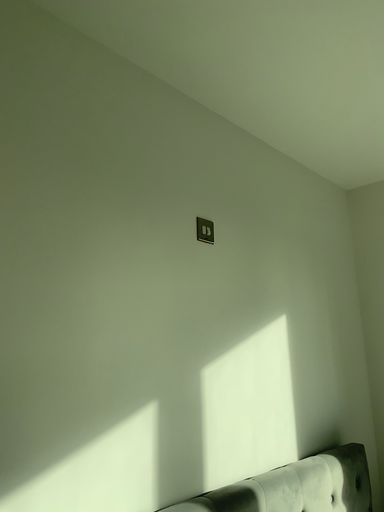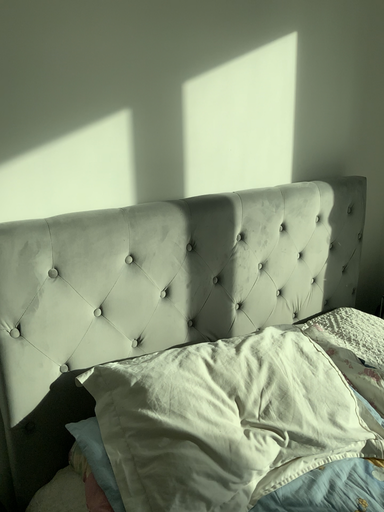
Question: Which way did the camera rotate in the video?

Choices:
 (A) rotated downward
 (B) rotated upward

Answer: (A)